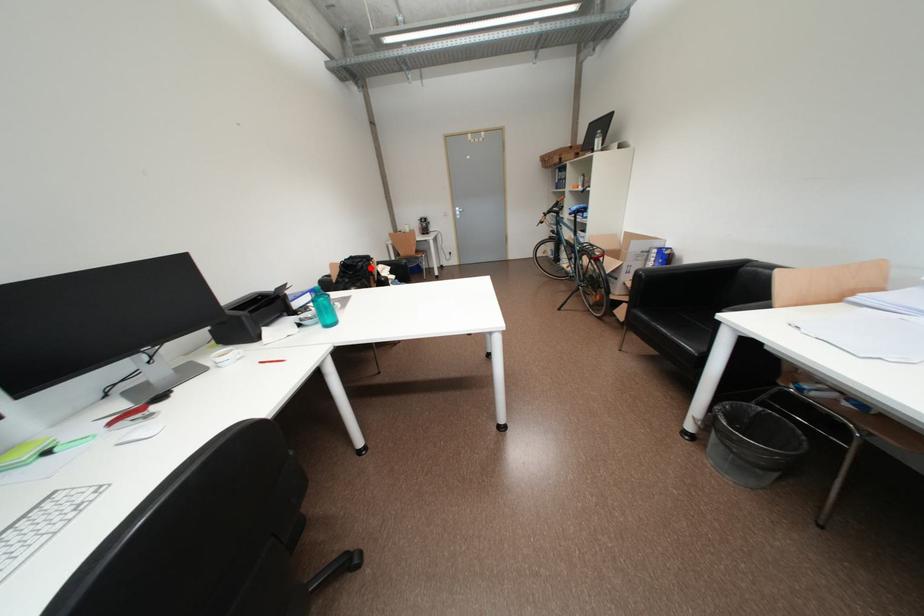
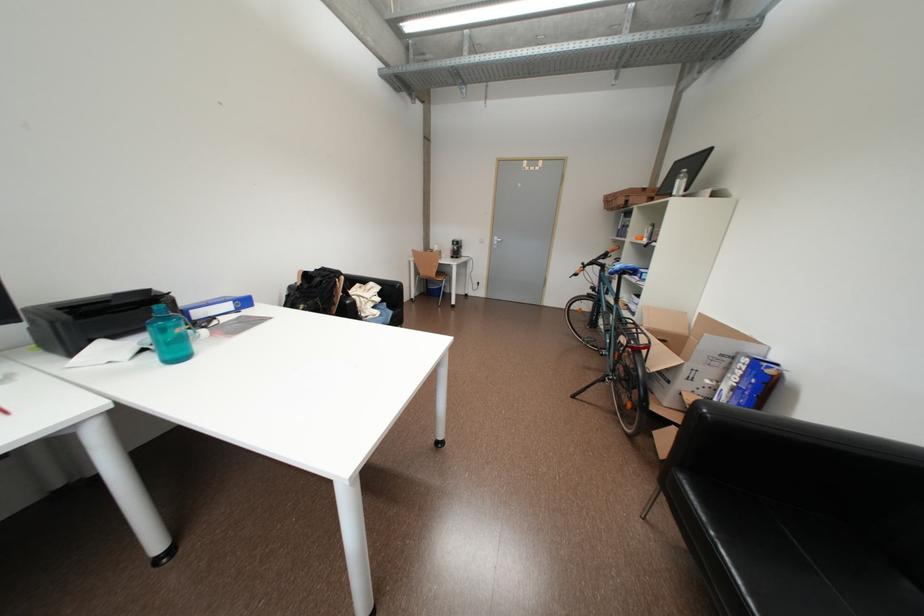
Question: I am providing you with two images of the same scene from different viewpoints. Given a red point in image1, look at the same physical point in image2. Is it:

Choices:
 (A) Closer to the viewpoint
 (B) Farther from the viewpoint

Answer: (B)